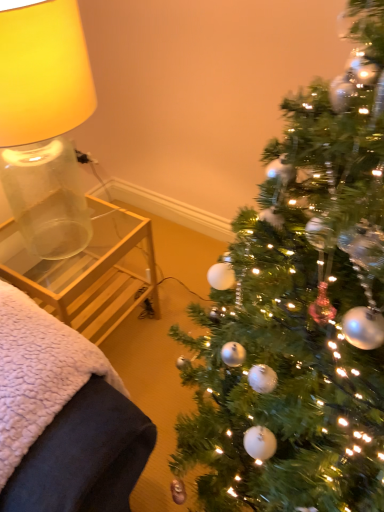
Question: From a real-world perspective, is clear glass table at left above or below green textured christmas tree at right?

Choices:
 (A) below
 (B) above

Answer: (A)

Question: Considering the positions of point (69, 309) and point (319, 449), is point (69, 309) closer or farther from the camera than point (319, 449)?

Choices:
 (A) closer
 (B) farther

Answer: (B)

Question: Considering the real-world distances, which object is closest to the translucent glass lampshade at left?

Choices:
 (A) clear glass table at left
 (B) clear glass side table at left
 (C) green textured christmas tree at right

Answer: (A)

Question: Estimate the real-world distances between objects in this image. Which object is closer to the green textured christmas tree at right?

Choices:
 (A) clear glass table at left
 (B) translucent glass lampshade at left
 (C) clear glass side table at left

Answer: (C)